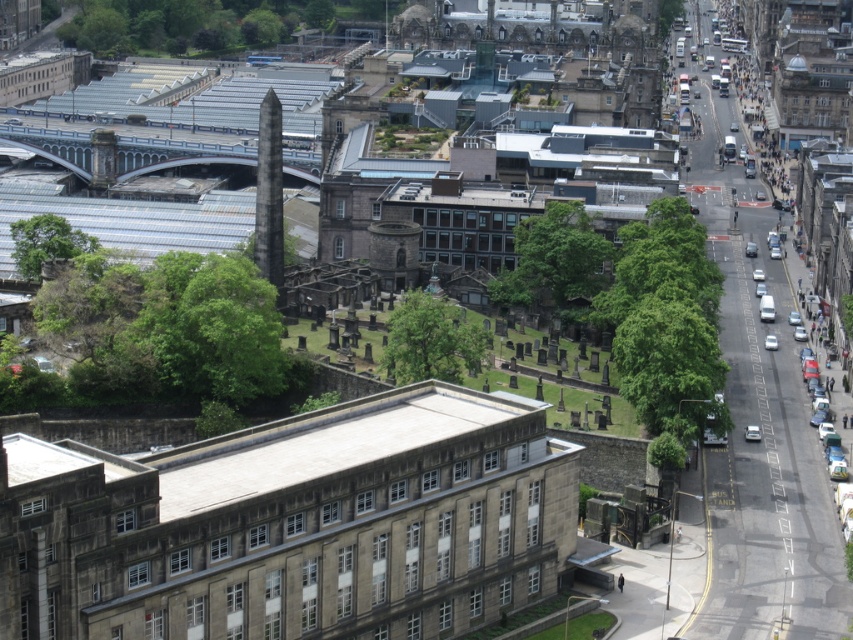
Who is lower down, silver metallic car at center-right or white matte car at right?

silver metallic car at center-right is below.

Is silver metallic car at center-right wider than white matte car at right?

Correct, the width of silver metallic car at center-right exceeds that of white matte car at right.

Between point (747, 429) and point (769, 348), which one is positioned in front?

Point (747, 429) is in front.

Where is `silver metallic car at center-right`? silver metallic car at center-right is located at coordinates 752,433.

Which is above, silver metallic car at center-right or metallic silver car at center-right?

metallic silver car at center-right is higher up.

Is silver metallic car at center-right shorter than metallic silver car at center-right?

Yes, silver metallic car at center-right is shorter than metallic silver car at center-right.

Who is more distant from viewer, (757, 440) or (756, 275)?

Positioned behind is point (756, 275).

The height and width of the screenshot is (640, 853). I want to click on silver metallic car at center-right, so click(x=752, y=433).

Between point (770, 348) and point (757, 280), which one is positioned behind?

Positioned behind is point (757, 280).

Which is in front, point (764, 340) or point (753, 269)?

Point (764, 340) is more forward.

The height and width of the screenshot is (640, 853). Find the location of `white matte car at right`. white matte car at right is located at coordinates (770, 342).